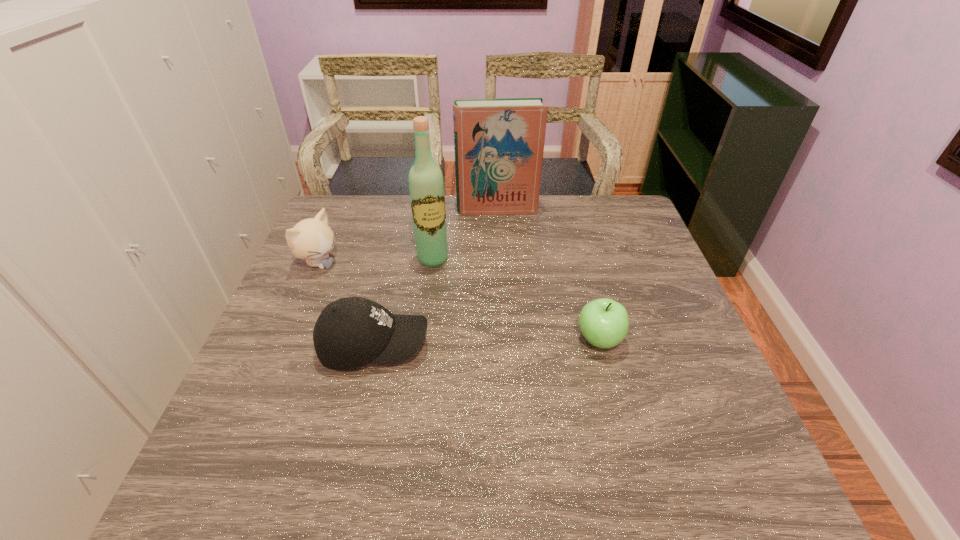
Where is `free space between the hardback book and the wine bottle`? The width and height of the screenshot is (960, 540). free space between the hardback book and the wine bottle is located at coordinates (465, 234).

I want to click on empty location between the baseball cap and the wine bottle, so click(x=403, y=302).

The width and height of the screenshot is (960, 540). In order to click on vacant area that lies between the wine bottle and the third shortest object in this screenshot , I will do `click(376, 261)`.

Where is `the fourth closest object to the apple`? The width and height of the screenshot is (960, 540). the fourth closest object to the apple is located at coordinates (312, 239).

Identify the location of object identified as the second closest to the baseball cap. (426, 186).

At what (x,y) coordinates should I click in order to perform the action: click on free location that satisfies the following two spatial constraints: 1. on the back side of the farthest object; 2. on the left side of the kitten. Please return your answer as a coordinate pair (x, y). Looking at the image, I should click on (342, 210).

The image size is (960, 540). Identify the location of free point that satisfies the following two spatial constraints: 1. on the front side of the wine bottle; 2. on the right side of the apple. (423, 340).

You are a GUI agent. You are given a task and a screenshot of the screen. Output one action in this format:
    pyautogui.click(x=<x>, y=<y>)
    Task: Click on the vacant area in the image that satisfies the following two spatial constraints: 1. on the front side of the rightmost object; 2. on the right side of the wine bottle
    The image size is (960, 540).
    Given the screenshot: What is the action you would take?
    pyautogui.click(x=423, y=340)